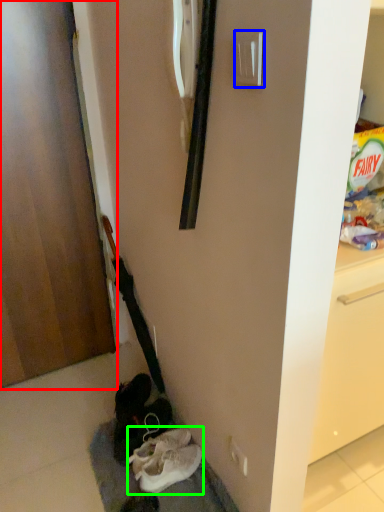
Question: Which object is the farthest from door (highlighted by a red box)? Choose among these: door handle (highlighted by a blue box) or footwear (highlighted by a green box).

Choices:
 (A) door handle
 (B) footwear

Answer: (A)